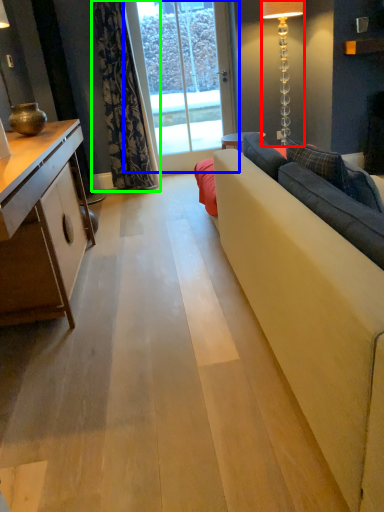
Question: Which object is the closest to the lamp (highlighted by a red box)? Choose among these: window screen (highlighted by a blue box) or curtain (highlighted by a green box).

Choices:
 (A) window screen
 (B) curtain

Answer: (A)